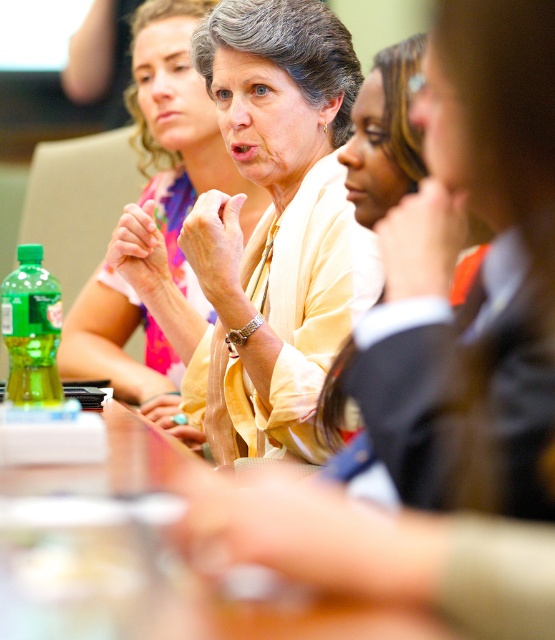
Question: Does clear plastic bottle at center have a lesser width compared to matte yellow blouse at center?

Choices:
 (A) yes
 (B) no

Answer: (A)

Question: Does yellow satin blouse at center come behind matte yellow blouse at center?

Choices:
 (A) yes
 (B) no

Answer: (B)

Question: Does yellow satin blouse at center lie in front of matte yellow blouse at center?

Choices:
 (A) yes
 (B) no

Answer: (A)

Question: Which object is positioned closest to the matte yellow blouse at center?

Choices:
 (A) clear plastic bottle at center
 (B) yellow satin blouse at center

Answer: (B)

Question: Which of these objects is positioned closest to the matte yellow blouse at center?

Choices:
 (A) clear plastic bottle at center
 (B) yellow satin blouse at center

Answer: (B)

Question: Which is nearer to the matte yellow blouse at center?

Choices:
 (A) clear plastic bottle at center
 (B) yellow satin blouse at center

Answer: (B)